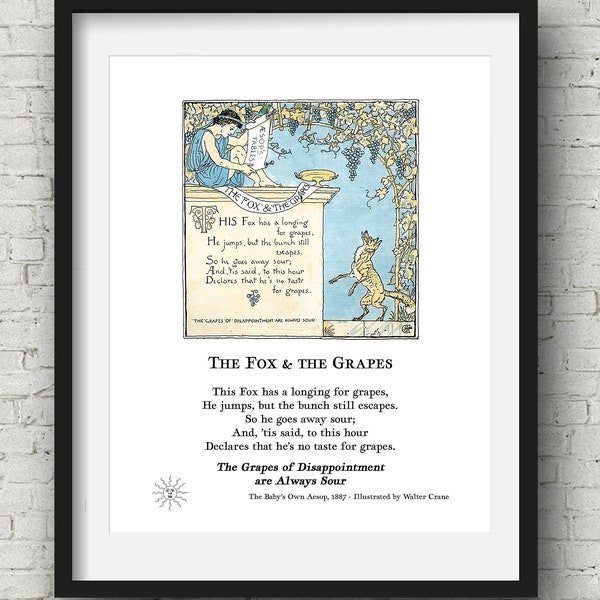
This screenshot has height=600, width=600. I want to click on wall, so click(x=561, y=349).